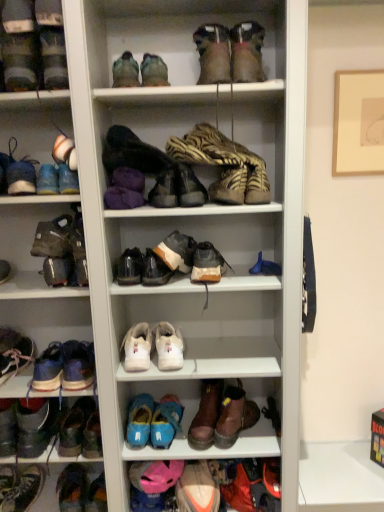
This screenshot has height=512, width=384. Describe the element at coordinates (65, 151) in the screenshot. I see `white matte shoe at upper left, which is counted as the second shoe, starting from the top` at that location.

You are a GUI agent. You are given a task and a screenshot of the screen. Output one action in this format:
    pyautogui.click(x=<x>, y=<y>)
    Task: Click on the white matte shoe at upper left, which is counted as the second shoe, starting from the top
    The height and width of the screenshot is (512, 384).
    Given the screenshot: What is the action you would take?
    pyautogui.click(x=65, y=151)

Measure the distance between leather/textured boot at center, the 2th footwear in the top-to-bottom sequence, and camera.

leather/textured boot at center, the 2th footwear in the top-to-bottom sequence, and camera are 1.28 meters apart.

What is the approximate width of matte black shoe at upper left, arranged as the 4th shoe when viewed from the top?

matte black shoe at upper left, arranged as the 4th shoe when viewed from the top, is 20.26 centimeters in width.

This screenshot has height=512, width=384. In order to click on leather boot at upper center, the 1th shoe from the top in this screenshot , I will do `click(213, 53)`.

Describe the element at coordinates (206, 415) in the screenshot. This screenshot has height=512, width=384. I see `brown leather boot at lower center, the twelfth shoe from the top` at that location.

Identify the location of white matte shoe at upper left, which ranks as the 17th shoe in bottom-to-top order. pyautogui.click(x=65, y=151).

Which is further, (27, 506) or (50, 177)?

The point (27, 506) is more distant.

Starting from the shiny black shoe at lower left, the first shoe from the bottom, which shoe is the 3rd one to the right? Please provide its 2D coordinates.

[(47, 180)]

Consider the image. Is shiny black shoe at lower left, the first shoe from the bottom, taller than matte blue shoe at left, marked as the 5th shoe in a top-to-bottom arrangement?

In fact, shiny black shoe at lower left, the first shoe from the bottom, may be shorter than matte blue shoe at left, marked as the 5th shoe in a top-to-bottom arrangement.

From the image's perspective, does shiny black shoe at lower left, the 18th shoe when ordered from top to bottom, appear lower than matte blue shoe at left, the 14th shoe from the bottom?

Yes.

Is the depth of blue suede shoes at lower center, placed as the fifth shoe when sorted from bottom to top, greater than that of brown suede sneaker at center, arranged as the twelfth shoe when ordered from the bottom?

Yes, it is.

Is blue suede shoes at lower center, the 14th shoe from the top, to the right of brown suede sneaker at center, arranged as the twelfth shoe when ordered from the bottom, from the viewer's perspective?

Incorrect, blue suede shoes at lower center, the 14th shoe from the top, is not on the right side of brown suede sneaker at center, arranged as the twelfth shoe when ordered from the bottom.

From the image's perspective, which object appears higher, blue suede shoes at lower center, placed as the fifth shoe when sorted from bottom to top, or brown suede sneaker at center, acting as the 7th shoe starting from the top?

brown suede sneaker at center, acting as the 7th shoe starting from the top, is shown above in the image.

Identify the location of the 7th shoe above the blue suede shoes at lower center, the 14th shoe from the top (from the image's perspective). (207, 264).

Would you consider white matte sneaker at center, the 9th shoe when ordered from bottom to top, to be distant from leather boot at lower left, positioned as the fifteenth shoe in top-to-bottom order?

No, white matte sneaker at center, the 9th shoe when ordered from bottom to top, is in close proximity to leather boot at lower left, positioned as the fifteenth shoe in top-to-bottom order.

Is white matte sneaker at center, the 9th shoe when ordered from bottom to top, taller than leather boot at lower left, which is counted as the 4th shoe, starting from the bottom?

No.

Would you say white matte sneaker at center, which ranks as the 10th shoe in top-to-bottom order, contains leather boot at lower left, which is counted as the 4th shoe, starting from the bottom?

No, leather boot at lower left, which is counted as the 4th shoe, starting from the bottom, is not surrounded by white matte sneaker at center, which ranks as the 10th shoe in top-to-bottom order.

Does white matte sneaker at center, which ranks as the 10th shoe in top-to-bottom order, have a greater width compared to leather boot at lower left, which is counted as the 4th shoe, starting from the bottom?

No.

How different are the orientations of leather bag at left, marked as the thirteenth shoe in a bottom-to-top arrangement, and leather boot at lower left, marked as the 2th footwear in a left-to-right arrangement, in degrees?

7.58 degrees separate the facing orientations of leather bag at left, marked as the thirteenth shoe in a bottom-to-top arrangement, and leather boot at lower left, marked as the 2th footwear in a left-to-right arrangement.

Between leather bag at left, marked as the thirteenth shoe in a bottom-to-top arrangement, and leather boot at lower left, marked as the 2th footwear in a left-to-right arrangement, which one has smaller size?

With smaller size is leather bag at left, marked as the thirteenth shoe in a bottom-to-top arrangement.

From the picture: Considering the sizes of leather bag at left, marked as the thirteenth shoe in a bottom-to-top arrangement, and leather boot at lower left, positioned as the 4th footwear in right-to-left order, in the image, is leather bag at left, marked as the thirteenth shoe in a bottom-to-top arrangement, wider or thinner than leather boot at lower left, positioned as the 4th footwear in right-to-left order,?

leather bag at left, marked as the thirteenth shoe in a bottom-to-top arrangement, is wider than leather boot at lower left, positioned as the 4th footwear in right-to-left order.

How much distance is there between leather bag at left, marked as the thirteenth shoe in a bottom-to-top arrangement, and leather boot at lower left, acting as the first footwear starting from the bottom?

leather bag at left, marked as the thirteenth shoe in a bottom-to-top arrangement, and leather boot at lower left, acting as the first footwear starting from the bottom, are 63.90 centimeters apart.

Does white leather sneakers at center, the 8th shoe from the bottom, have a larger size compared to leather boot at upper center, the 1th shoe from the top?

No, white leather sneakers at center, the 8th shoe from the bottom, is not bigger than leather boot at upper center, the 1th shoe from the top.

Consider the image. Is white leather sneakers at center, positioned as the 11th shoe in top-to-bottom order, with leather boot at upper center, the 1th shoe from the top?

white leather sneakers at center, positioned as the 11th shoe in top-to-bottom order, is not next to leather boot at upper center, the 1th shoe from the top, and they're not touching.

Does white leather sneakers at center, the 8th shoe from the bottom, have a lesser height compared to leather boot at upper center, which is the 18th shoe from bottom to top?

Correct, white leather sneakers at center, the 8th shoe from the bottom, is not as tall as leather boot at upper center, which is the 18th shoe from bottom to top.

Is light blue suede sneakers at lower left, the first footwear in the left-to-right sequence, taller than multicolored fabric shoe at lower left, the 17th shoe viewed from the top?

Correct, light blue suede sneakers at lower left, the first footwear in the left-to-right sequence, is much taller as multicolored fabric shoe at lower left, the 17th shoe viewed from the top.

Which is more to the left, light blue suede sneakers at lower left, the first footwear in the left-to-right sequence, or multicolored fabric shoe at lower left, positioned as the second shoe in bottom-to-top order?

From the viewer's perspective, light blue suede sneakers at lower left, the first footwear in the left-to-right sequence, appears more on the left side.

Is light blue suede sneakers at lower left, the second footwear in the bottom-to-top sequence, thinner than multicolored fabric shoe at lower left, the 17th shoe viewed from the top?

Yes.

How far apart are leather at center, acting as the ninth shoe starting from the top, and matte blue sneaker at left, which is the sixteenth shoe in bottom-to-top order?

18.82 inches.

Is leather at center, which ranks as the 10th shoe in bottom-to-top order, to the left or to the right of matte blue sneaker at left, acting as the third shoe starting from the top, in the image?

Clearly, leather at center, which ranks as the 10th shoe in bottom-to-top order, is on the right of matte blue sneaker at left, acting as the third shoe starting from the top, in the image.

Based on the photo, considering the relative sizes of leather at center, which ranks as the 10th shoe in bottom-to-top order, and matte blue sneaker at left, acting as the third shoe starting from the top, in the image provided, is leather at center, which ranks as the 10th shoe in bottom-to-top order, bigger than matte blue sneaker at left, acting as the third shoe starting from the top,?

Correct, leather at center, which ranks as the 10th shoe in bottom-to-top order, is larger in size than matte blue sneaker at left, acting as the third shoe starting from the top.

Is leather at center, which ranks as the 10th shoe in bottom-to-top order, taller than matte blue sneaker at left, acting as the third shoe starting from the top?

Incorrect, the height of leather at center, which ranks as the 10th shoe in bottom-to-top order, is not larger of that of matte blue sneaker at left, acting as the third shoe starting from the top.

The height and width of the screenshot is (512, 384). Identify the location of the 3rd shoe to the right when counting from the shiny black shoe at lower left, the 18th shoe when ordered from top to bottom. (47, 180).

Where is `the 4th shoe behind when counting from the brown suede sneaker at center, acting as the 7th shoe starting from the top`? the 4th shoe behind when counting from the brown suede sneaker at center, acting as the 7th shoe starting from the top is located at coordinates pos(166,421).

Which object lies further to the anchor point matte black shoe at upper left, arranged as the 4th shoe when viewed from the top, matte blue sneaker at left, which is the sixteenth shoe in bottom-to-top order, or white matte sneaker at center, the 9th shoe when ordered from bottom to top?

white matte sneaker at center, the 9th shoe when ordered from bottom to top.

Looking at the image, which one is located closer to leather at center, acting as the ninth shoe starting from the top, white matte sneaker at center, which ranks as the 10th shoe in top-to-bottom order, or leather boot at upper center, which is the 18th shoe from bottom to top?

white matte sneaker at center, which ranks as the 10th shoe in top-to-bottom order, is positioned closer to the anchor leather at center, acting as the ninth shoe starting from the top.

Considering their positions, is matte gray boot at upper left, the third footwear in the right-to-left sequence, positioned further to blue suede shoe at center, which is counted as the eleventh shoe, starting from the bottom, than shiny black shoe at lower left, the 18th shoe when ordered from top to bottom?

Among the two, shiny black shoe at lower left, the 18th shoe when ordered from top to bottom, is located further to blue suede shoe at center, which is counted as the eleventh shoe, starting from the bottom.

Estimate the real-world distances between objects in this image. Which object is further from brown suede sneaker at center, arranged as the twelfth shoe when ordered from the bottom, leather/textured boot at center, which appears as the fifth footwear when viewed from the left, or matte black shoe at upper left, arranged as the 15th shoe when ordered from the bottom?

matte black shoe at upper left, arranged as the 15th shoe when ordered from the bottom, is positioned further to the anchor brown suede sneaker at center, arranged as the twelfth shoe when ordered from the bottom.

Which object lies nearer to the anchor point multicolored fabric shoe at lower left, the 17th shoe viewed from the top, leather bag at left, marked as the thirteenth shoe in a bottom-to-top arrangement, or matte black shoe at upper left, arranged as the 15th shoe when ordered from the bottom?

leather bag at left, marked as the thirteenth shoe in a bottom-to-top arrangement, lies closer to multicolored fabric shoe at lower left, the 17th shoe viewed from the top, than the other object.

Which object lies further to the anchor point blue suede shoes at center, acting as the sixth shoe starting from the bottom, orange suede sneaker at lower center, the sixteenth shoe when ordered from top to bottom, or brown leather boot at lower center, the twelfth shoe from the top?

Based on the image, orange suede sneaker at lower center, the sixteenth shoe when ordered from top to bottom, appears to be further to blue suede shoes at center, acting as the sixth shoe starting from the bottom.

Looking at the image, which one is located closer to matte blue sneaker at left, which is the sixteenth shoe in bottom-to-top order, matte gray boot at upper left, the first footwear in the top-to-bottom sequence, or blue suede shoes at lower center, placed as the fifth shoe when sorted from bottom to top?

matte gray boot at upper left, the first footwear in the top-to-bottom sequence, is positioned closer to the anchor matte blue sneaker at left, which is the sixteenth shoe in bottom-to-top order.

Estimate the real-world distances between objects in this image. Which object is closer to white matte sneaker at center, the 9th shoe when ordered from bottom to top, white matte shoe at upper left, which is counted as the second shoe, starting from the top, or leather boot at lower left, which is counted as the 4th shoe, starting from the bottom?

leather boot at lower left, which is counted as the 4th shoe, starting from the bottom.

Find the location of a particular element. shoe between leather at center, which ranks as the 10th shoe in bottom-to-top order, and white leather sneakers at center, positioned as the 11th shoe in top-to-bottom order, in the up-down direction is located at coordinates (169, 347).

At what (x,y) coordinates should I click in order to perform the action: click on footwear between white matte shoe at upper left, which is counted as the second shoe, starting from the top, and blue suede shoe at center, which is counted as the eleventh shoe, starting from the bottom, in the horizontal direction. Please return your answer as a coordinate pair (x, y). The width and height of the screenshot is (384, 512). Looking at the image, I should click on (195, 161).

Find the location of a particular element. The image size is (384, 512). footwear between leather bag at left, acting as the sixth shoe starting from the top, and light blue suede sneakers at lower left, the fifth footwear from the right, in the vertical direction is located at coordinates (64, 367).

Find the location of a particular element. shoe between white matte sneaker at center, which ranks as the 10th shoe in top-to-bottom order, and brown leather boot at lower center, the twelfth shoe from the top, in the up-down direction is located at coordinates (137, 347).